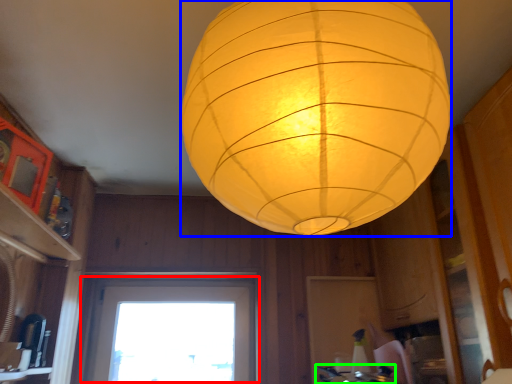
Question: Estimate the real-world distances between objects in this image. Which object is farther from window (highlighted by a red box), lantern (highlighted by a blue box) or gas stove (highlighted by a green box)?

Choices:
 (A) lantern
 (B) gas stove

Answer: (A)